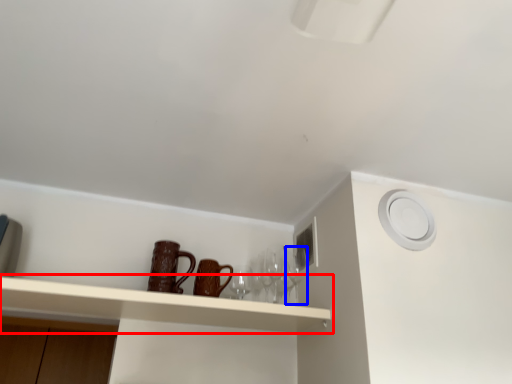
Question: Which of the following is the farthest to the observer, shelf (highlighted by a red box) or wine glass (highlighted by a blue box)?

Choices:
 (A) shelf
 (B) wine glass

Answer: (B)